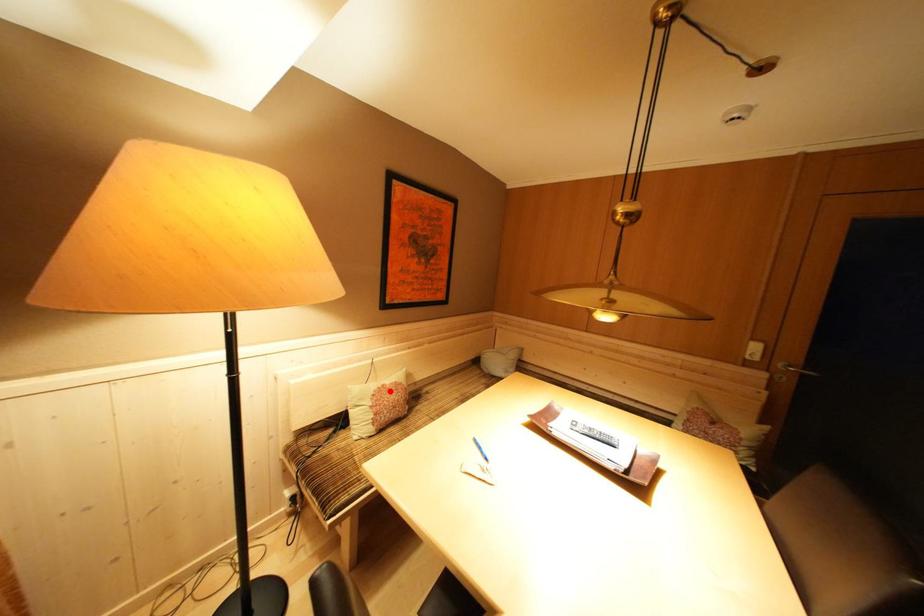
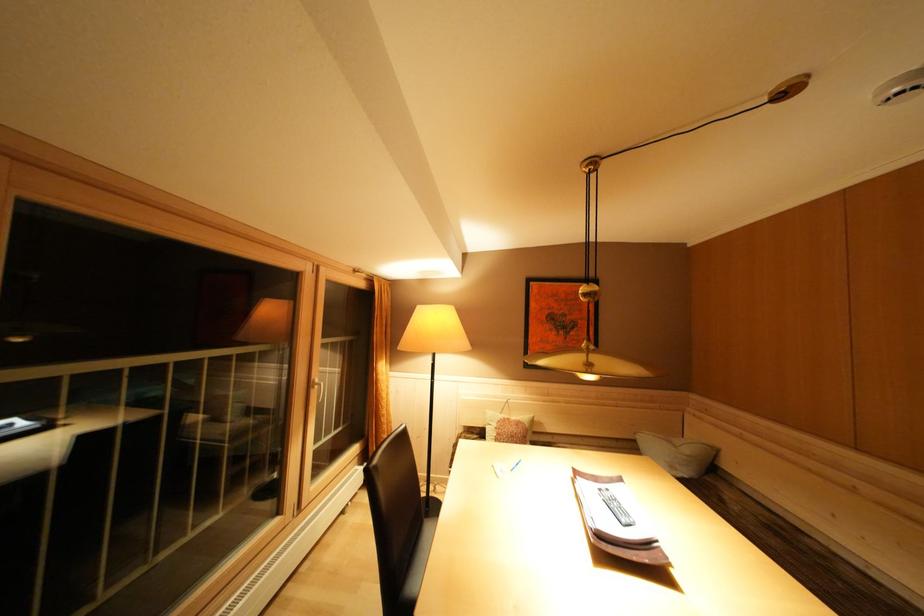
In the second image, find the point that corresponds to the highlighted location in the first image.

(515, 424)